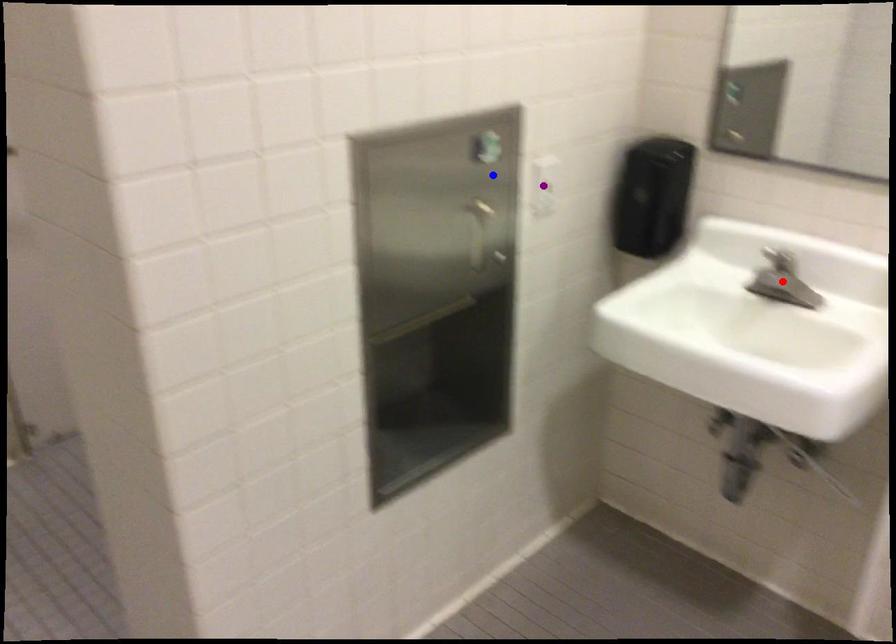
Order these from nearest to farthest:
A) red point
B) purple point
C) blue point

red point, blue point, purple point